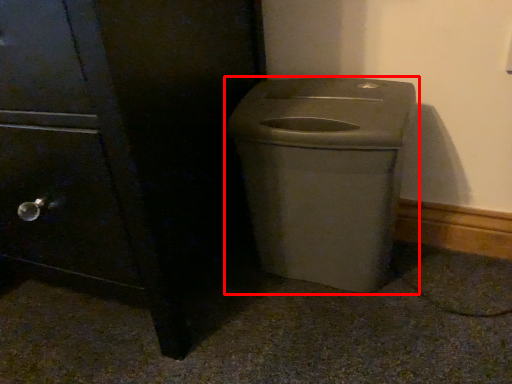
Question: From the image, what is the correct spatial relationship of waste container (annotated by the red box) in relation to side cabinet?

Choices:
 (A) right
 (B) left

Answer: (A)